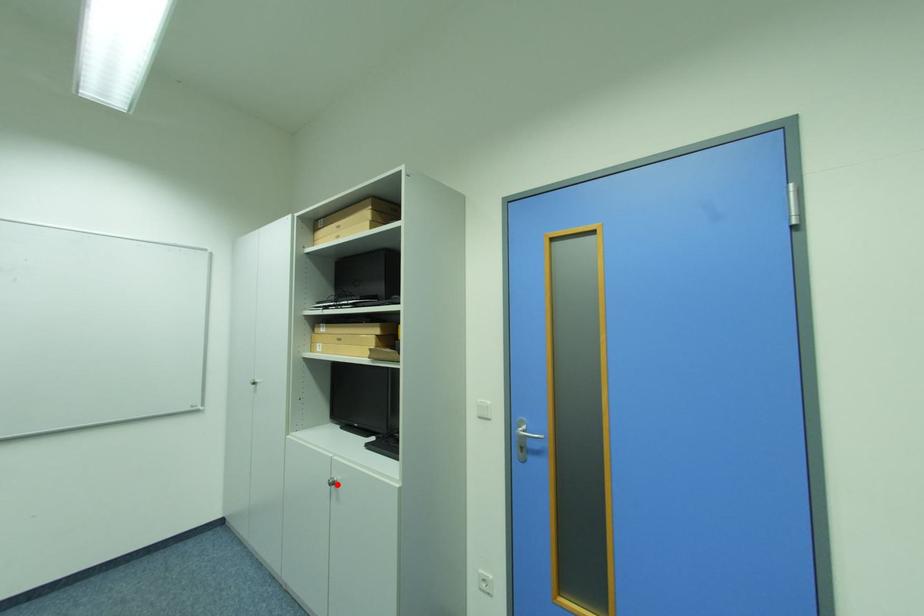
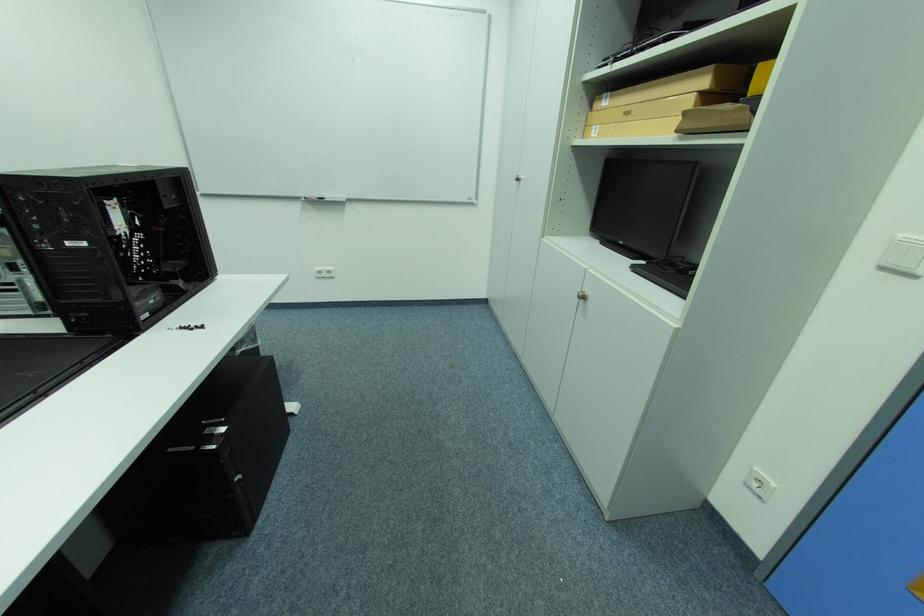
In the second image, find the point that corresponds to the highlighted location in the first image.

(587, 297)